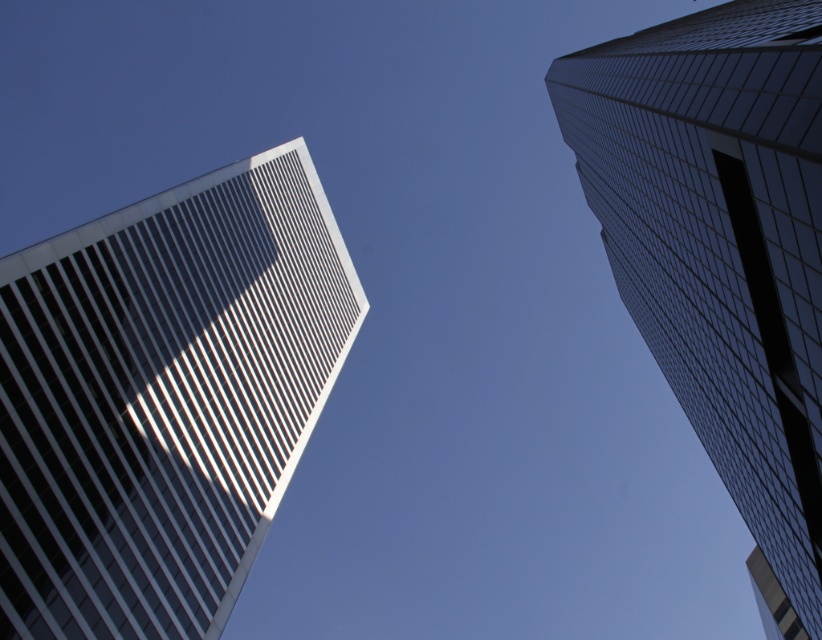
You are a photographer planning to capture both the white glass building at upper left and the glassy reflective skyscraper at upper right in a single frame. Based on their sizes in the image, which building would you need to position your camera closer to in order to include both adequately?

Since the white glass building at upper left occupies less space than the glassy reflective skyscraper at upper right, you should position your camera closer to the white glass building at upper left to ensure both structures are adequately framed in the photograph.

You are a drone operator planning to fly a drone between the two skyscrapers. The drone has a maximum flight height of 500 meters. According to the scene, can the drone safely navigate between the white glass building at upper left and the glassy reflective skyscraper at upper right without hitting either building?

The white glass building at upper left is shorter than the glassy reflective skyscraper at upper right. Since the drone has a maximum flight height of 500 meters, it can safely navigate between them as long as the shorter building is under 500 meters. However, the exact height isn